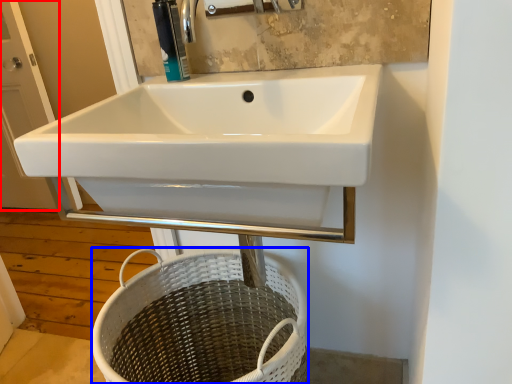
Question: Which object appears farthest to the camera in this image, screen door (highlighted by a red box) or basket (highlighted by a blue box)?

Choices:
 (A) screen door
 (B) basket

Answer: (A)